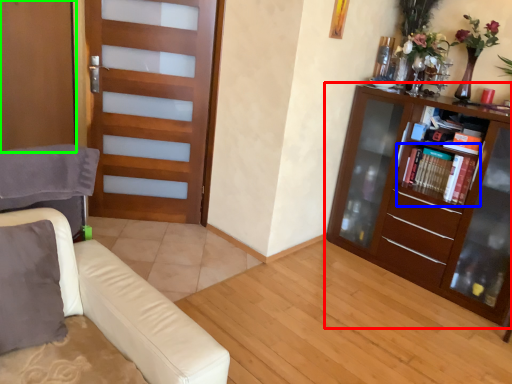
Question: Considering the real-world distances, which object is farthest from bookcase (highlighted by a red box)? shelf (highlighted by a blue box) or screen door (highlighted by a green box)?

Choices:
 (A) shelf
 (B) screen door

Answer: (B)